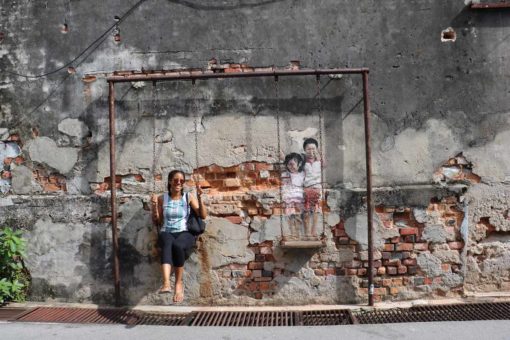
Find the location of a particular element. The width and height of the screenshot is (510, 340). exposed brick is located at coordinates (401, 255).